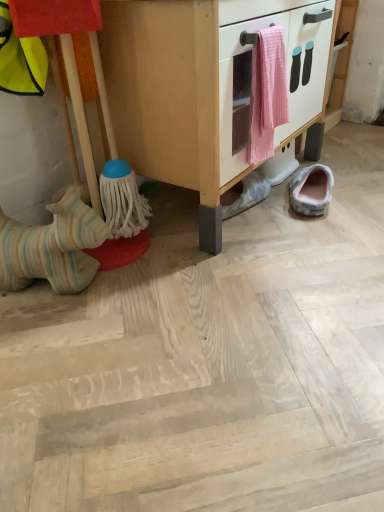
The image size is (384, 512). I want to click on wooden cabinet at center, so click(x=199, y=88).

How much space does light pink fabric slipper at lower right, positioned as the 3th footwear in left-to-right order, occupy vertically?

light pink fabric slipper at lower right, positioned as the 3th footwear in left-to-right order, is 3.72 inches in height.

Find the location of a particular element. This screenshot has height=512, width=384. wooden cabinet at center is located at coordinates (199, 88).

Is wooden cabinet at center completely or partially inside striped fabric toy at lower left, the first footwear viewed from the left?

Definitely not — wooden cabinet at center is not inside striped fabric toy at lower left, the first footwear viewed from the left.

Is striped fabric toy at lower left, the third footwear in the right-to-left sequence, taller than wooden cabinet at center?

In fact, striped fabric toy at lower left, the third footwear in the right-to-left sequence, may be shorter than wooden cabinet at center.

Between point (76, 283) and point (205, 73), which one is positioned in front?

The point (205, 73) is more forward.

Is striped fabric toy at lower left, the first footwear viewed from the left, facing towards wooden cabinet at center?

No, striped fabric toy at lower left, the first footwear viewed from the left, is not facing towards wooden cabinet at center.

Which of these two, light pink fabric slipper at lower right, the first footwear positioned from the right, or white fabric slipper at lower center, the 2th footwear positioned from the left, is thinner?

With smaller width is white fabric slipper at lower center, the 2th footwear positioned from the left.

Would you consider light pink fabric slipper at lower right, the first footwear positioned from the right, to be distant from white fabric slipper at lower center, the 2th footwear positioned from the left?

No, there isn't a large distance between light pink fabric slipper at lower right, the first footwear positioned from the right, and white fabric slipper at lower center, the 2th footwear positioned from the left.

Is light pink fabric slipper at lower right, positioned as the 3th footwear in left-to-right order, oriented towards white fabric slipper at lower center, the second footwear when ordered from right to left?

No, light pink fabric slipper at lower right, positioned as the 3th footwear in left-to-right order, is not aimed at white fabric slipper at lower center, the second footwear when ordered from right to left.

From the picture: From a real-world perspective, who is located higher, light pink fabric slipper at lower right, positioned as the 3th footwear in left-to-right order, or white fabric slipper at lower center, the 2th footwear positioned from the left?

In real-world perspective, light pink fabric slipper at lower right, positioned as the 3th footwear in left-to-right order, is above.

From a real-world perspective, which is physically above, striped fabric horse at left or pink woven towel at center?

pink woven towel at center.

Is striped fabric horse at left inside the boundaries of pink woven towel at center, or outside?

striped fabric horse at left is not enclosed by pink woven towel at center.

From the image's perspective, is striped fabric horse at left located above or below pink woven towel at center?

From the image's perspective, striped fabric horse at left appears below pink woven towel at center.

Does striped fabric horse at left have a greater width compared to pink woven towel at center?

Yes, striped fabric horse at left is wider than pink woven towel at center.

Does point (232, 208) come farther from viewer compared to point (82, 226)?

That is True.

From the image's perspective, which footwear is the 1st one above the striped fabric toy at lower left, the first footwear viewed from the left? Please provide its 2D coordinates.

[(248, 194)]

Does white fabric slipper at lower center, the 2th footwear positioned from the left, appear on the left side of striped fabric toy at lower left, the first footwear viewed from the left?

Incorrect, white fabric slipper at lower center, the 2th footwear positioned from the left, is not on the left side of striped fabric toy at lower left, the first footwear viewed from the left.

Which is correct: white fabric slipper at lower center, the 2th footwear positioned from the left, is inside light pink fabric slipper at lower right, the first footwear positioned from the right, or outside of it?

white fabric slipper at lower center, the 2th footwear positioned from the left, is located beyond the bounds of light pink fabric slipper at lower right, the first footwear positioned from the right.

From a real-world perspective, who is located higher, white fabric slipper at lower center, the 2th footwear positioned from the left, or light pink fabric slipper at lower right, the first footwear positioned from the right?

From a 3D spatial view, light pink fabric slipper at lower right, the first footwear positioned from the right, is above.

Considering the points (224, 211) and (306, 195), which point is in front, point (224, 211) or point (306, 195)?

The point (224, 211) is closer to the camera.

Based on the photo, can we say striped fabric toy at lower left, the third footwear in the right-to-left sequence, lies outside light pink fabric slipper at lower right, the first footwear positioned from the right?

Yes.

Who is smaller, striped fabric toy at lower left, the third footwear in the right-to-left sequence, or light pink fabric slipper at lower right, positioned as the 3th footwear in left-to-right order?

Smaller between the two is light pink fabric slipper at lower right, positioned as the 3th footwear in left-to-right order.

Consider the image. From a real-world perspective, is striped fabric toy at lower left, the first footwear viewed from the left, physically located above or below light pink fabric slipper at lower right, positioned as the 3th footwear in left-to-right order?

striped fabric toy at lower left, the first footwear viewed from the left, is situated higher than light pink fabric slipper at lower right, positioned as the 3th footwear in left-to-right order, in the real world.

Consider the image. Considering the sizes of objects striped fabric toy at lower left, the first footwear viewed from the left, and light pink fabric slipper at lower right, positioned as the 3th footwear in left-to-right order, in the image provided, who is wider, striped fabric toy at lower left, the first footwear viewed from the left, or light pink fabric slipper at lower right, positioned as the 3th footwear in left-to-right order,?

striped fabric toy at lower left, the first footwear viewed from the left.

Is the surface of wooden cabinet at center in direct contact with striped fabric toy at lower left, the first footwear viewed from the left?

wooden cabinet at center and striped fabric toy at lower left, the first footwear viewed from the left, are not in contact.

From the image's perspective, who appears lower, wooden cabinet at center or striped fabric toy at lower left, the first footwear viewed from the left?

striped fabric toy at lower left, the first footwear viewed from the left.

From a real-world perspective, is wooden cabinet at center positioned over striped fabric toy at lower left, the first footwear viewed from the left, based on gravity?

Yes, from a real-world perspective, wooden cabinet at center is over striped fabric toy at lower left, the first footwear viewed from the left

At what (x,y) coordinates should I click in order to perform the action: click on cabinetry located on the right of striped fabric toy at lower left, the first footwear viewed from the left. Please return your answer as a coordinate pair (x, y). The width and height of the screenshot is (384, 512). Looking at the image, I should click on (199, 88).

Where is `footwear that is behind the light pink fabric slipper at lower right, positioned as the 3th footwear in left-to-right order`? footwear that is behind the light pink fabric slipper at lower right, positioned as the 3th footwear in left-to-right order is located at coordinates (248, 194).

When comparing their distances from white fabric slipper at lower center, the second footwear when ordered from right to left, does pink woven towel at center or striped fabric toy at lower left, the third footwear in the right-to-left sequence, seem further?

The object further to white fabric slipper at lower center, the second footwear when ordered from right to left, is striped fabric toy at lower left, the third footwear in the right-to-left sequence.

From the image, which object appears to be farther from pink woven towel at center, light pink fabric slipper at lower right, positioned as the 3th footwear in left-to-right order, or wooden cabinet at center?

light pink fabric slipper at lower right, positioned as the 3th footwear in left-to-right order.

From the image, which object appears to be farther from striped fabric toy at lower left, the third footwear in the right-to-left sequence, pink woven towel at center or light pink fabric slipper at lower right, positioned as the 3th footwear in left-to-right order?

light pink fabric slipper at lower right, positioned as the 3th footwear in left-to-right order.

Based on their spatial positions, is light pink fabric slipper at lower right, positioned as the 3th footwear in left-to-right order, or striped fabric horse at left further from wooden cabinet at center?

Based on the image, light pink fabric slipper at lower right, positioned as the 3th footwear in left-to-right order, appears to be further to wooden cabinet at center.

Which object lies nearer to the anchor point white fabric slipper at lower center, the 2th footwear positioned from the left, striped fabric horse at left or striped fabric toy at lower left, the third footwear in the right-to-left sequence?

The object closer to white fabric slipper at lower center, the 2th footwear positioned from the left, is striped fabric horse at left.

Estimate the real-world distances between objects in this image. Which object is closer to light pink fabric slipper at lower right, positioned as the 3th footwear in left-to-right order, pink woven towel at center or striped fabric toy at lower left, the first footwear viewed from the left?

pink woven towel at center is closer to light pink fabric slipper at lower right, positioned as the 3th footwear in left-to-right order.

Which object lies further to the anchor point striped fabric toy at lower left, the third footwear in the right-to-left sequence, light pink fabric slipper at lower right, positioned as the 3th footwear in left-to-right order, or striped fabric horse at left?

light pink fabric slipper at lower right, positioned as the 3th footwear in left-to-right order, lies further to striped fabric toy at lower left, the third footwear in the right-to-left sequence, than the other object.

Which object lies nearer to the anchor point light pink fabric slipper at lower right, positioned as the 3th footwear in left-to-right order, wooden cabinet at center or white fabric slipper at lower center, the 2th footwear positioned from the left?

The object closer to light pink fabric slipper at lower right, positioned as the 3th footwear in left-to-right order, is white fabric slipper at lower center, the 2th footwear positioned from the left.

At what (x,y) coordinates should I click in order to perform the action: click on laundry located between striped fabric toy at lower left, the third footwear in the right-to-left sequence, and light pink fabric slipper at lower right, positioned as the 3th footwear in left-to-right order, in the left-right direction. Please return your answer as a coordinate pair (x, y). The height and width of the screenshot is (512, 384). Looking at the image, I should click on (267, 93).

In order to click on toy between wooden cabinet at center and striped fabric toy at lower left, the first footwear viewed from the left, in the vertical direction in this screenshot , I will do `click(87, 129)`.

Find the location of a particular element. The height and width of the screenshot is (512, 384). toy between striped fabric toy at lower left, the first footwear viewed from the left, and pink woven towel at center from left to right is located at coordinates (87, 129).

Locate an element on the screen. laundry situated between striped fabric horse at left and light pink fabric slipper at lower right, positioned as the 3th footwear in left-to-right order, from left to right is located at coordinates (267, 93).